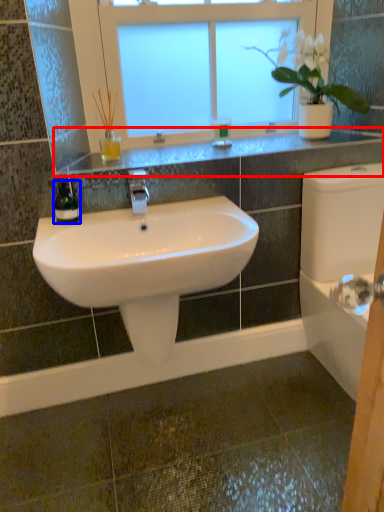
Question: Which object appears closest to the camera in this image, window sill (highlighted by a red box) or soap dispenser (highlighted by a blue box)?

Choices:
 (A) window sill
 (B) soap dispenser

Answer: (B)